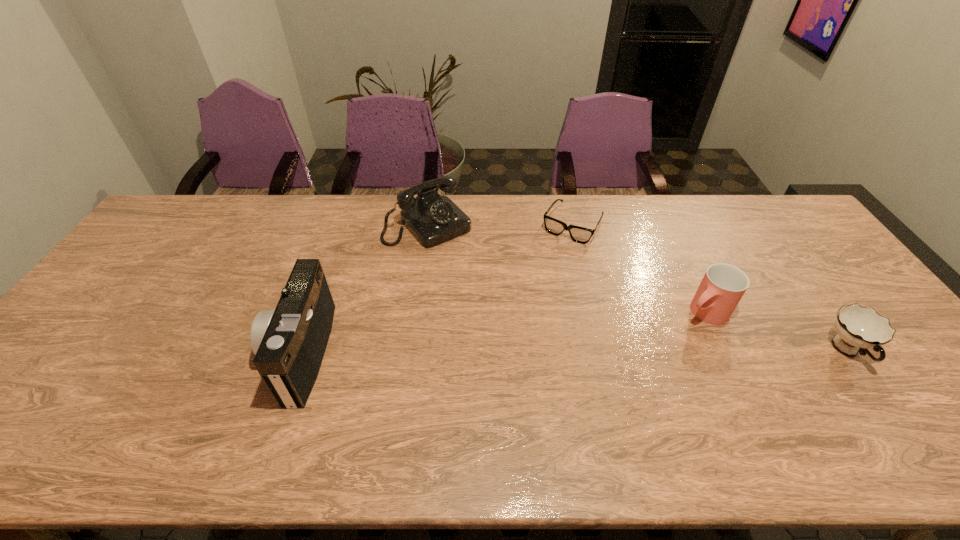
The image size is (960, 540). What are the coordinates of `camcorder` in the screenshot? It's located at (x=289, y=342).

Find the location of a particular element. This screenshot has height=540, width=960. the tallest object is located at coordinates (289, 342).

This screenshot has height=540, width=960. Find the location of `the fourth tallest object`. the fourth tallest object is located at coordinates (859, 328).

This screenshot has width=960, height=540. I want to click on the shorter cup, so click(859, 328).

In order to click on the fourth object from right to left in this screenshot , I will do `click(433, 219)`.

I want to click on the third object from left to right, so click(x=578, y=234).

What are the coordinates of `the shortest object` in the screenshot? It's located at (578, 234).

Image resolution: width=960 pixels, height=540 pixels. In order to click on the second object from right to left in this screenshot , I will do `click(722, 287)`.

Image resolution: width=960 pixels, height=540 pixels. I want to click on the left cup, so click(x=722, y=287).

Image resolution: width=960 pixels, height=540 pixels. Identify the location of free location located 0.210m on the lens of the tallest object. (190, 353).